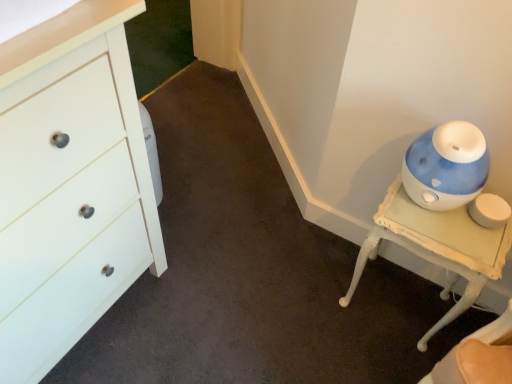
Question: In terms of height, does white matte chest of drawers at left look taller or shorter compared to blue glossy humidifier at right?

Choices:
 (A) tall
 (B) short

Answer: (A)

Question: Is point (105, 162) closer or farther from the camera than point (464, 215)?

Choices:
 (A) closer
 (B) farther

Answer: (A)

Question: Is white matte chest of drawers at left wider or thinner than blue glossy humidifier at right?

Choices:
 (A) thin
 (B) wide

Answer: (B)

Question: Is blue glossy humidifier at right taller or shorter than white matte chest of drawers at left?

Choices:
 (A) short
 (B) tall

Answer: (A)

Question: Considering the positions of blue glossy humidifier at right and white matte chest of drawers at left in the image, is blue glossy humidifier at right wider or thinner than white matte chest of drawers at left?

Choices:
 (A) wide
 (B) thin

Answer: (B)

Question: Considering their positions, is blue glossy humidifier at right located in front of or behind white matte chest of drawers at left?

Choices:
 (A) front
 (B) behind

Answer: (B)

Question: Is blue glossy humidifier at right inside the boundaries of white matte chest of drawers at left, or outside?

Choices:
 (A) inside
 (B) outside

Answer: (B)